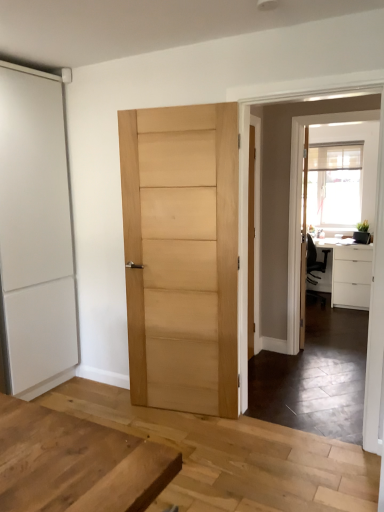
Question: In terms of height, does white matte cabinet at right look taller or shorter compared to white matte sliding door at left, placed as the first door when sorted from left to right?

Choices:
 (A) short
 (B) tall

Answer: (A)

Question: Considering their positions, is white matte cabinet at right located in front of or behind white matte sliding door at left, placed as the first door when sorted from left to right?

Choices:
 (A) behind
 (B) front

Answer: (A)

Question: Which object is the farthest from the natural wood door at center, the second door from the left?

Choices:
 (A) clear glass screen door at upper right
 (B) white matte cabinet at right
 (C) white matte sliding door at left, placed as the first door when sorted from left to right

Answer: (A)

Question: Estimate the real-world distances between objects in this image. Which object is farther from the natural wood door at center, which is the first door in right-to-left order?

Choices:
 (A) clear glass screen door at upper right
 (B) white matte sliding door at left, placed as the first door when sorted from left to right
 (C) white matte cabinet at right

Answer: (A)